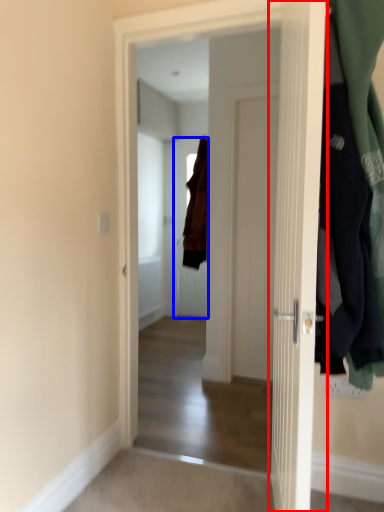
Question: Which object is further to the camera taking this photo, door (highlighted by a red box) or door (highlighted by a blue box)?

Choices:
 (A) door
 (B) door

Answer: (B)